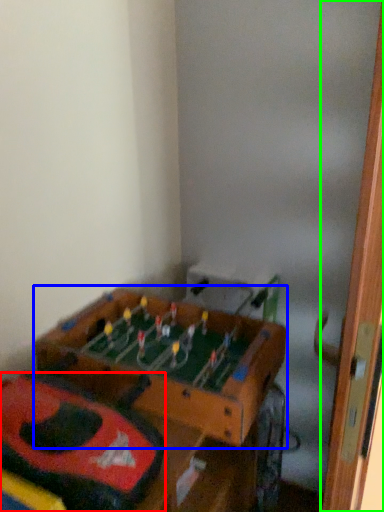
Question: Considering the real-world distances, which object is closest to kit (highlighted by a red box)? table (highlighted by a blue box) or door (highlighted by a green box).

Choices:
 (A) table
 (B) door

Answer: (A)